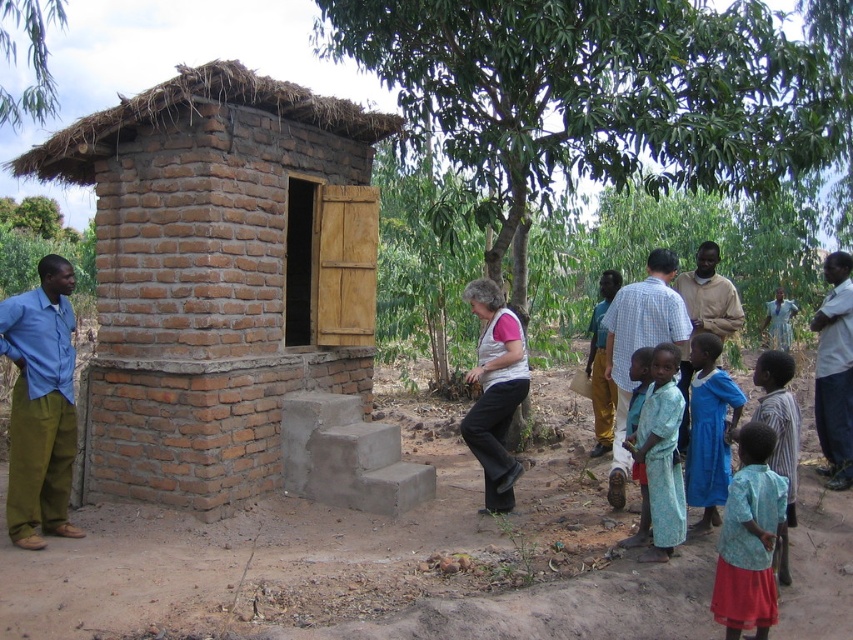
Question: Which of the following is the farthest from the observer?

Choices:
 (A) blue cotton shirt at left
 (B) blue cotton shirt at lower right

Answer: (A)

Question: Which of the following is the farthest from the observer?

Choices:
 (A) [x=196, y=429]
 (B) [x=637, y=541]

Answer: (A)

Question: Is brown brick hut at left to the right of light blue fabric dress at lower right from the viewer's perspective?

Choices:
 (A) no
 (B) yes

Answer: (A)

Question: Considering the real-world distances, which object is closest to the beige cotton shirt at center?

Choices:
 (A) blue cotton shirt at left
 (B) light blue fabric shirt at lower right
 (C) brown brick hut at left

Answer: (B)

Question: Is brown brick hut at left bigger than light blue fabric shirt at lower right?

Choices:
 (A) no
 (B) yes

Answer: (B)

Question: Is the position of light blue fabric dress at lower right more distant than that of blue cotton shirt at lower right?

Choices:
 (A) no
 (B) yes

Answer: (B)